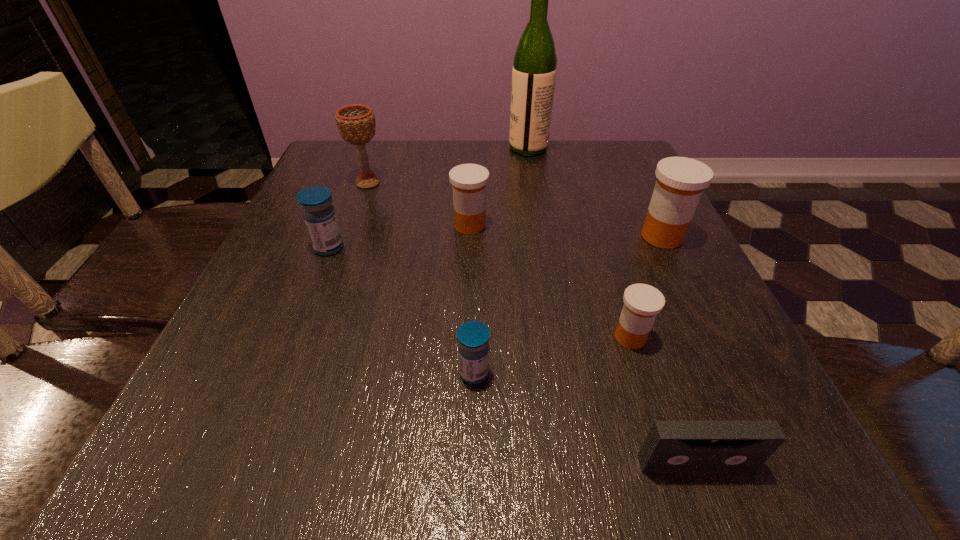
What are the coordinates of `chalice at the left edge` in the screenshot? It's located at point(356,123).

At what (x,y) coordinates should I click in order to perform the action: click on medicine that is positioned at the left edge. Please return your answer as a coordinate pair (x, y). Looking at the image, I should click on (319, 215).

Locate an element on the screen. videotape located in the right edge section of the desktop is located at coordinates tap(671, 446).

The image size is (960, 540). In order to click on object at the far left corner in this screenshot , I will do `click(356, 123)`.

You are a GUI agent. You are given a task and a screenshot of the screen. Output one action in this format:
    pyautogui.click(x=<x>, y=<y>)
    Task: Click on the object present at the near right corner
    
    Given the screenshot: What is the action you would take?
    pyautogui.click(x=671, y=446)

Identify the location of vacant space at the far edge. (431, 148).

In the image, there is a desktop. Identify the location of free space at the near edge. (291, 461).

Find the location of a particular element. The height and width of the screenshot is (540, 960). vacant region at the left edge of the desktop is located at coordinates (327, 304).

This screenshot has height=540, width=960. In order to click on vacant area at the right edge in this screenshot , I will do `click(702, 343)`.

At what (x,y) coordinates should I click in order to perform the action: click on free region at the far right corner. Please return your answer as a coordinate pair (x, y). This screenshot has width=960, height=540. Looking at the image, I should click on (581, 165).